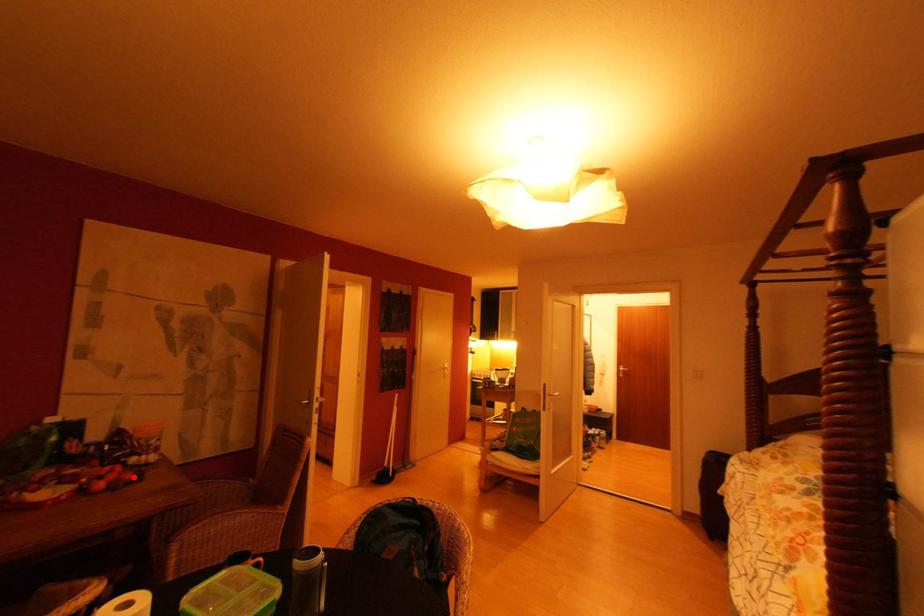
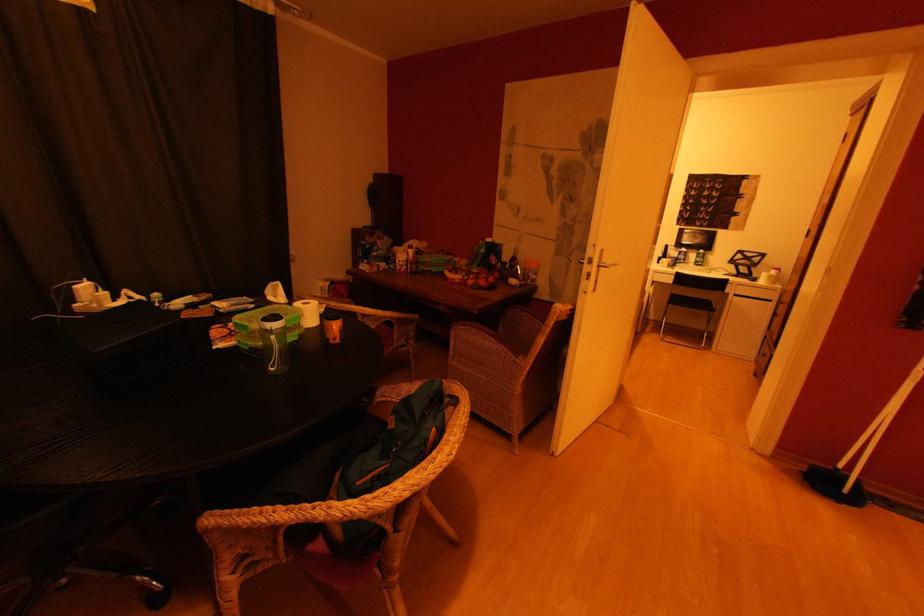
The point at the highlighted location is marked in the first image. Where is the corresponding point in the second image?

(488, 285)